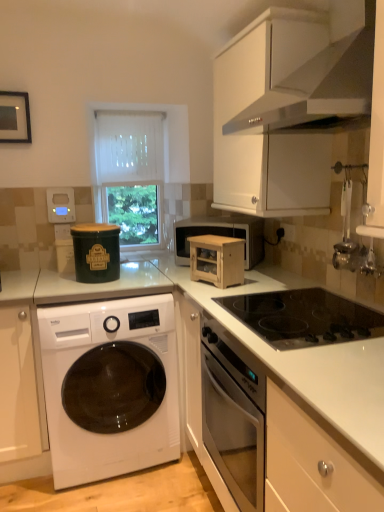
Question: Considering the positions of black glass cooktop at center and green matte container at upper left, the second appliance in the front-to-back sequence, in the image, is black glass cooktop at center bigger or smaller than green matte container at upper left, the second appliance in the front-to-back sequence,?

Choices:
 (A) big
 (B) small

Answer: (A)

Question: From the image's perspective, is black glass cooktop at center above or below green matte container at upper left, which is the second appliance in right-to-left order?

Choices:
 (A) above
 (B) below

Answer: (B)

Question: Which object is the farthest from the matte white thermostat at upper left, the third appliance positioned from the front?

Choices:
 (A) white sheer curtain at center
 (B) white matte cabinet at lower left, the second cabinetry in the right-to-left sequence
 (C) green matte container at upper left, the second appliance in the front-to-back sequence
 (D) wooden cabinet at center, which is the 1th appliance from right to left
 (E) white matte cabinet at upper right, which ranks as the 1th cabinetry in top-to-bottom order

Answer: (E)

Question: Based on their relative distances, which object is farther from the green matte container at upper left, which is the second appliance in right-to-left order?

Choices:
 (A) white sheer curtain at center
 (B) wooden cabinet at center, which is the 1th appliance in front-to-back order
 (C) white matte cabinet at upper right, which appears as the second cabinetry when viewed from the left
 (D) wooden microwave at center
 (E) matte white thermostat at upper left, marked as the third appliance in a right-to-left arrangement

Answer: (C)